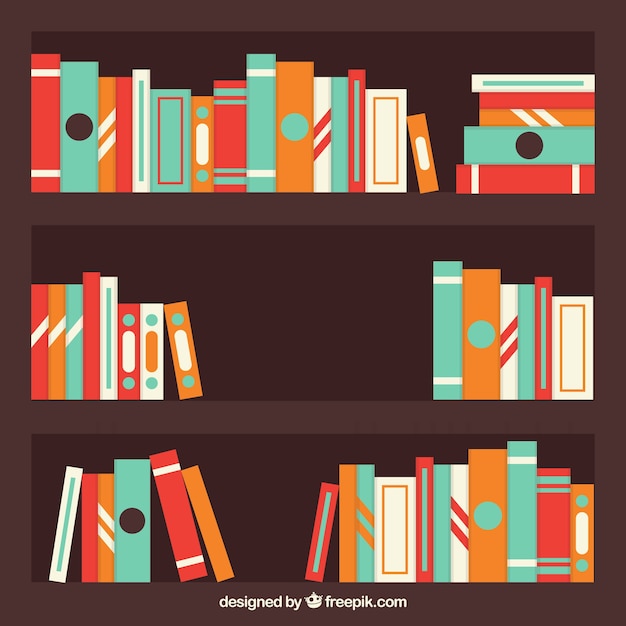
Identify the location of books stacked on top of one another horizontally. (550, 178), (557, 146), (555, 114), (553, 99), (550, 85).